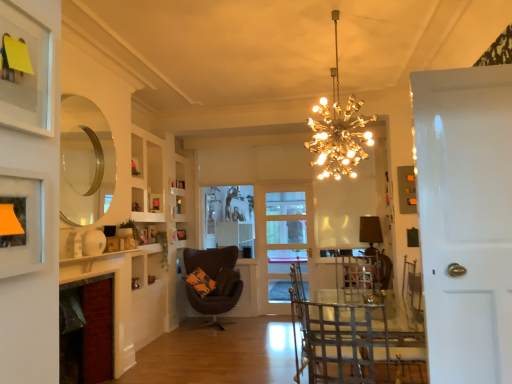
Question: In terms of width, does matte black picture frame at upper left, positioned as the 5th picture frame in back-to-front order, look wider or thinner when compared to red brick fireplace at lower left?

Choices:
 (A) wide
 (B) thin

Answer: (B)

Question: In the image, is matte black picture frame at upper left, which is the second picture frame in right-to-left order, positioned in front of or behind red brick fireplace at lower left?

Choices:
 (A) behind
 (B) front

Answer: (B)

Question: Estimate the real-world distances between objects in this image. Which object is closer to the metallic wire armchair at center?

Choices:
 (A) dark brown leather chair at lower left, arranged as the first chair when viewed from the back
 (B) red brick fireplace at lower left
 (C) matte black picture frame at upper left, which is counted as the fourth picture frame, starting from the left
 (D) matte black picture frame at upper center, the 3th picture frame when ordered from left to right
 (E) brown fabric lampshade at center

Answer: (C)

Question: Based on their relative distances, which object is nearer to the dark brown leather chair at lower left, the first chair when ordered from left to right?

Choices:
 (A) matte black picture frame at upper left, which is counted as the fourth picture frame, starting from the left
 (B) matte gray picture frame at upper right, acting as the fifth picture frame starting from the left
 (C) matte black picture frame at center, the first picture frame in the back-to-front sequence
 (D) matte black picture frame at upper center, which is the 3th picture frame from back to front
 (E) white glossy door at right, which ranks as the second door in back-to-front order

Answer: (C)